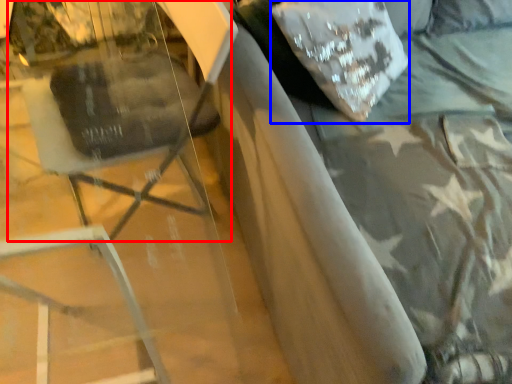
Question: Among these objects, which one is farthest to the camera, swivel chair (highlighted by a red box) or pillow (highlighted by a blue box)?

Choices:
 (A) swivel chair
 (B) pillow

Answer: (B)